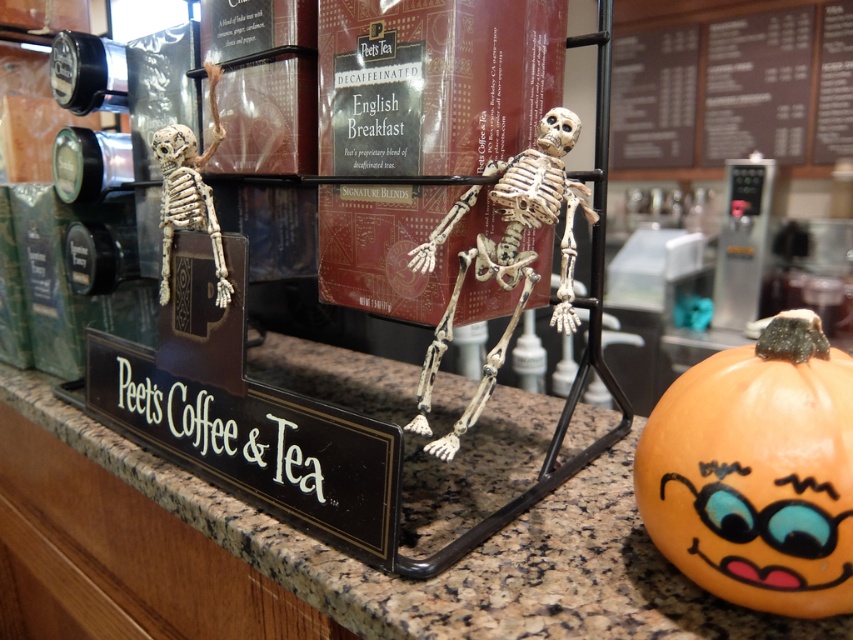
You are a customer at Peet Coffee and Tea and you want to order a drink. You are standing at the counter and see the granite countertop at center and the dark brown wooden menu at upper right. Which object is located higher up?

The dark brown wooden menu at upper right is located higher up than the granite countertop at center.